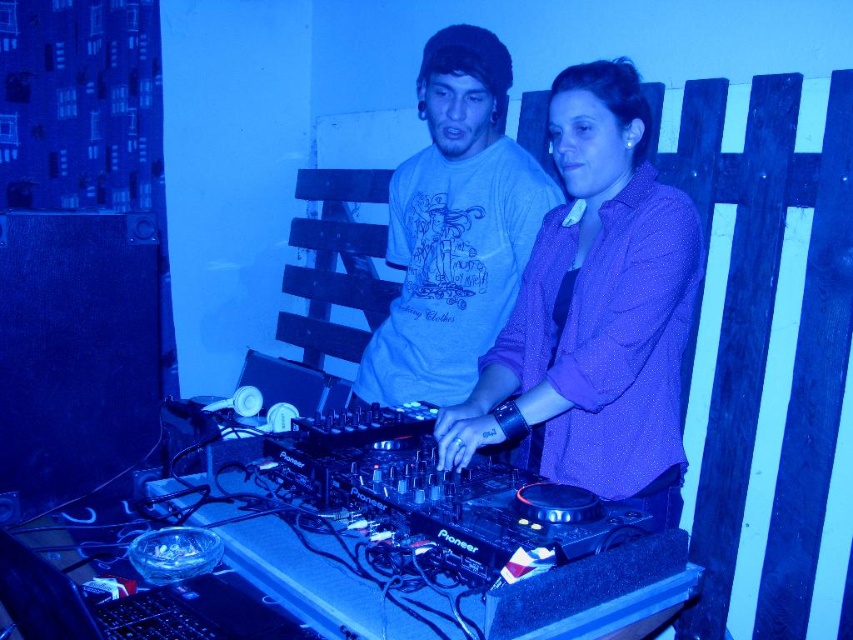
You are taking a photo of the DJ setup and notice two points marked in the image. The first point is at coordinates point (583, 387) and the second at point (463, 227). Which point is closer to the camera?

Point (583, 387) is closer to the camera than point (463, 227).